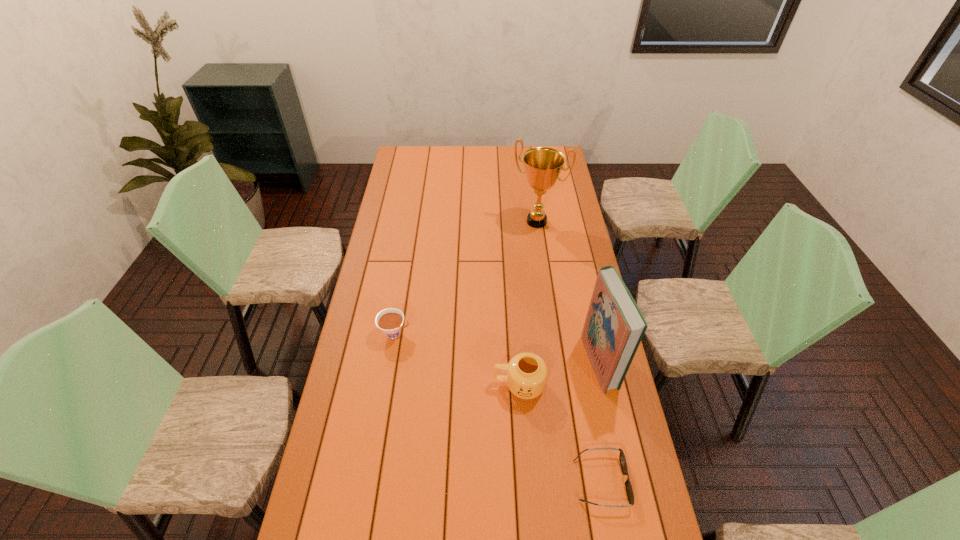
Locate an element on the screen. The image size is (960, 540). the leftmost object is located at coordinates (390, 320).

Identify the location of the second shortest object. (390, 320).

At what (x,y) coordinates should I click in order to perform the action: click on sunglasses. Please return your answer as a coordinate pair (x, y). The height and width of the screenshot is (540, 960). Looking at the image, I should click on (629, 490).

At what (x,y) coordinates should I click in order to perform the action: click on the nearest object. Please return your answer as a coordinate pair (x, y). The height and width of the screenshot is (540, 960). Looking at the image, I should click on (629, 490).

Where is `the farthest object`? This screenshot has width=960, height=540. the farthest object is located at coordinates [543, 165].

You are a GUI agent. You are given a task and a screenshot of the screen. Output one action in this format:
    pyautogui.click(x=<x>, y=<y>)
    Task: Click on the third shortest object
    
    Given the screenshot: What is the action you would take?
    click(526, 376)

At what (x,y) coordinates should I click in order to perform the action: click on the fourth shortest object. Please return your answer as a coordinate pair (x, y). Image resolution: width=960 pixels, height=540 pixels. Looking at the image, I should click on (614, 327).

You are a GUI agent. You are given a task and a screenshot of the screen. Output one action in this format:
    pyautogui.click(x=<x>, y=<y>)
    Task: Click on the vacant space located 0.090m on the side of the fourth tallest object with the handle
    
    Given the screenshot: What is the action you would take?
    pyautogui.click(x=436, y=334)

The image size is (960, 540). I want to click on vacant point located 0.050m on the front-facing side of the nearest object, so click(x=644, y=481).

Identify the location of free space located on the front view with handles of the award. (524, 242).